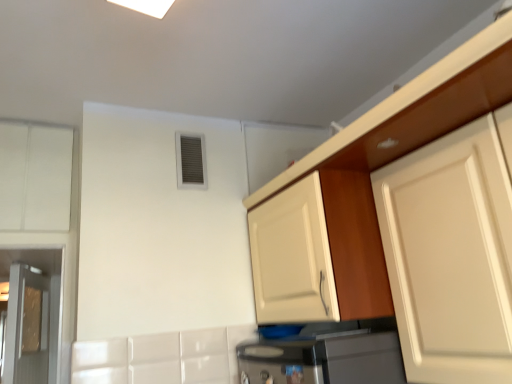
What do you see at coordinates (27, 327) in the screenshot? I see `metallic glass door at left` at bounding box center [27, 327].

What are the coordinates of `metallic glass door at left` in the screenshot? It's located at (27, 327).

From the image's perspective, does matte white cabinet at center, which appears as the second cabinetry when viewed from the left, appear lower than white matte cabinet at left, the 1th cabinetry viewed from the left?

Indeed, from the image's perspective, matte white cabinet at center, which appears as the second cabinetry when viewed from the left, is shown beneath white matte cabinet at left, the 1th cabinetry viewed from the left.

Is matte white cabinet at center, which ranks as the third cabinetry in right-to-left order, turned away from white matte cabinet at left, which appears as the 4th cabinetry when viewed from the right?

No, white matte cabinet at left, which appears as the 4th cabinetry when viewed from the right, is not at the back of matte white cabinet at center, which ranks as the third cabinetry in right-to-left order.

Is matte white cabinet at center, which ranks as the third cabinetry in right-to-left order, smaller than white matte cabinet at left, which appears as the 4th cabinetry when viewed from the right?

Actually, matte white cabinet at center, which ranks as the third cabinetry in right-to-left order, might be larger than white matte cabinet at left, which appears as the 4th cabinetry when viewed from the right.

Which cabinetry is the 1st one when counting from the front of the white matte cabinet at left, the 1th cabinetry viewed from the left? Please provide its 2D coordinates.

[(319, 252)]

The width and height of the screenshot is (512, 384). I want to click on cabinetry that is the 1st object located in front of the white matte cabinet at left, which appears as the 4th cabinetry when viewed from the right, so click(x=319, y=252).

Considering the sizes of white matte cabinet at left, the 1th cabinetry viewed from the left, and matte white cabinet at center, which appears as the second cabinetry when viewed from the left, in the image, is white matte cabinet at left, the 1th cabinetry viewed from the left, wider or thinner than matte white cabinet at center, which appears as the second cabinetry when viewed from the left,?

white matte cabinet at left, the 1th cabinetry viewed from the left, is thinner than matte white cabinet at center, which appears as the second cabinetry when viewed from the left.

From the image's perspective, which is above, white matte cabinet at left, which appears as the 4th cabinetry when viewed from the right, or matte white cabinet at center, which appears as the second cabinetry when viewed from the left?

white matte cabinet at left, which appears as the 4th cabinetry when viewed from the right, appears higher in the image.

Considering the positions of point (56, 188) and point (295, 250), is point (56, 188) closer or farther from the camera than point (295, 250)?

Point (56, 188) is farther from the camera than point (295, 250).

Does white glossy cabinet at upper right, acting as the second cabinetry starting from the right, appear on the left side of metallic glass door at left?

No, white glossy cabinet at upper right, acting as the second cabinetry starting from the right, is not to the left of metallic glass door at left.

Does white glossy cabinet at upper right, acting as the second cabinetry starting from the right, have a smaller size compared to metallic glass door at left?

Correct, white glossy cabinet at upper right, acting as the second cabinetry starting from the right, occupies less space than metallic glass door at left.

From the image's perspective, is white glossy cabinet at upper right, acting as the second cabinetry starting from the right, on metallic glass door at left?

Indeed, from the image's perspective, white glossy cabinet at upper right, acting as the second cabinetry starting from the right, is shown above metallic glass door at left.

Is white glossy cabinet at upper right, placed as the third cabinetry when sorted from left to right, oriented away from metallic glass door at left?

No, metallic glass door at left is not at the back of white glossy cabinet at upper right, placed as the third cabinetry when sorted from left to right.

Between metallic glass door at left and matte white cabinet at center, which appears as the second cabinetry when viewed from the left, which one has more height?

metallic glass door at left is taller.

Can you tell me how much metallic glass door at left and matte white cabinet at center, which appears as the second cabinetry when viewed from the left, differ in facing direction?

The angular difference between metallic glass door at left and matte white cabinet at center, which appears as the second cabinetry when viewed from the left, is 12.4 degrees.

Considering their positions, is metallic glass door at left located in front of or behind matte white cabinet at center, which ranks as the third cabinetry in right-to-left order?

metallic glass door at left is behind matte white cabinet at center, which ranks as the third cabinetry in right-to-left order.

From the image's perspective, is metallic glass door at left beneath matte white cabinet at center, which ranks as the third cabinetry in right-to-left order?

Yes, from the image's perspective, metallic glass door at left is below matte white cabinet at center, which ranks as the third cabinetry in right-to-left order.

From the picture: Does matte white cabinet at center, which ranks as the third cabinetry in right-to-left order, come in front of white matte cabinet at upper right, the first cabinetry viewed from the right?

No.

How different are the orientations of matte white cabinet at center, which appears as the second cabinetry when viewed from the left, and white matte cabinet at upper right, which ranks as the fourth cabinetry in left-to-right order, in degrees?

7.23e-05 degrees.

Who is shorter, matte white cabinet at center, which ranks as the third cabinetry in right-to-left order, or white matte cabinet at upper right, which ranks as the fourth cabinetry in left-to-right order?

matte white cabinet at center, which ranks as the third cabinetry in right-to-left order, is shorter.

Does white glossy cabinet at upper right, placed as the third cabinetry when sorted from left to right, have a smaller size compared to matte white cabinet at center, which appears as the second cabinetry when viewed from the left?

Correct, white glossy cabinet at upper right, placed as the third cabinetry when sorted from left to right, occupies less space than matte white cabinet at center, which appears as the second cabinetry when viewed from the left.

From the image's perspective, would you say white glossy cabinet at upper right, acting as the second cabinetry starting from the right, is shown under matte white cabinet at center, which appears as the second cabinetry when viewed from the left?

No.

Does white glossy cabinet at upper right, placed as the third cabinetry when sorted from left to right, turn towards matte white cabinet at center, which ranks as the third cabinetry in right-to-left order?

No, white glossy cabinet at upper right, placed as the third cabinetry when sorted from left to right, is not turned towards matte white cabinet at center, which ranks as the third cabinetry in right-to-left order.

Is white glossy cabinet at upper right, acting as the second cabinetry starting from the right, far from matte white cabinet at center, which ranks as the third cabinetry in right-to-left order?

white glossy cabinet at upper right, acting as the second cabinetry starting from the right, is near matte white cabinet at center, which ranks as the third cabinetry in right-to-left order, not far away.

Would you say metallic glass door at left is a long distance from white glossy cabinet at upper right, acting as the second cabinetry starting from the right?

Yes, metallic glass door at left and white glossy cabinet at upper right, acting as the second cabinetry starting from the right, are quite far apart.

Which of these two, metallic glass door at left or white glossy cabinet at upper right, placed as the third cabinetry when sorted from left to right, is thinner?

metallic glass door at left is thinner.

Is metallic glass door at left facing towards white glossy cabinet at upper right, placed as the third cabinetry when sorted from left to right?

No, metallic glass door at left is not turned towards white glossy cabinet at upper right, placed as the third cabinetry when sorted from left to right.

From a real-world perspective, is metallic glass door at left physically located above or below white glossy cabinet at upper right, placed as the third cabinetry when sorted from left to right?

From a real-world perspective, metallic glass door at left is physically below white glossy cabinet at upper right, placed as the third cabinetry when sorted from left to right.

Locate an element on the screen. The image size is (512, 384). cabinetry that is the 2nd one below the white matte cabinet at left, the 1th cabinetry viewed from the left (from a real-world perspective) is located at coordinates (319, 252).

From the image's perspective, starting from the white matte cabinet at left, the 1th cabinetry viewed from the left, which cabinetry is the 2nd one below? Please provide its 2D coordinates.

[(319, 252)]

Estimate the real-world distances between objects in this image. Which object is further from white matte cabinet at left, the 1th cabinetry viewed from the left, white matte cabinet at upper right, which ranks as the fourth cabinetry in left-to-right order, or metallic glass door at left?

white matte cabinet at upper right, which ranks as the fourth cabinetry in left-to-right order, is further to white matte cabinet at left, the 1th cabinetry viewed from the left.

Which object lies nearer to the anchor point white matte cabinet at left, the 1th cabinetry viewed from the left, white matte cabinet at upper right, the first cabinetry viewed from the right, or matte white cabinet at center, which appears as the second cabinetry when viewed from the left?

Among the two, matte white cabinet at center, which appears as the second cabinetry when viewed from the left, is located nearer to white matte cabinet at left, the 1th cabinetry viewed from the left.

Looking at the image, which one is located further to metallic glass door at left, white matte cabinet at upper right, the first cabinetry viewed from the right, or matte white cabinet at center, which appears as the second cabinetry when viewed from the left?

Among the two, white matte cabinet at upper right, the first cabinetry viewed from the right, is located further to metallic glass door at left.

Based on their spatial positions, is white glossy cabinet at upper right, placed as the third cabinetry when sorted from left to right, or white matte cabinet at left, which appears as the 4th cabinetry when viewed from the right, closer to metallic glass door at left?

Among the two, white matte cabinet at left, which appears as the 4th cabinetry when viewed from the right, is located nearer to metallic glass door at left.

From the picture: Considering their positions, is matte white cabinet at center, which appears as the second cabinetry when viewed from the left, positioned closer to white glossy cabinet at upper right, placed as the third cabinetry when sorted from left to right, than white matte cabinet at left, which appears as the 4th cabinetry when viewed from the right?

Among the two, matte white cabinet at center, which appears as the second cabinetry when viewed from the left, is located nearer to white glossy cabinet at upper right, placed as the third cabinetry when sorted from left to right.

When comparing their distances from metallic glass door at left, does white matte cabinet at upper right, which ranks as the fourth cabinetry in left-to-right order, or white matte cabinet at left, the 1th cabinetry viewed from the left, seem closer?

white matte cabinet at left, the 1th cabinetry viewed from the left.

Considering their positions, is white glossy cabinet at upper right, acting as the second cabinetry starting from the right, positioned further to white matte cabinet at upper right, the first cabinetry viewed from the right, than white matte cabinet at left, the 1th cabinetry viewed from the left?

white matte cabinet at left, the 1th cabinetry viewed from the left.

Estimate the real-world distances between objects in this image. Which object is further from white matte cabinet at upper right, which ranks as the fourth cabinetry in left-to-right order, white matte cabinet at left, the 1th cabinetry viewed from the left, or matte white cabinet at center, which appears as the second cabinetry when viewed from the left?

The object further to white matte cabinet at upper right, which ranks as the fourth cabinetry in left-to-right order, is white matte cabinet at left, the 1th cabinetry viewed from the left.

You are a GUI agent. You are given a task and a screenshot of the screen. Output one action in this format:
    pyautogui.click(x=<x>, y=<y>)
    Task: Click on the cabinetry positioned between white glossy cabinet at upper right, acting as the second cabinetry starting from the right, and matte white cabinet at center, which ranks as the third cabinetry in right-to-left order, from near to far
    This screenshot has width=512, height=384.
    Given the screenshot: What is the action you would take?
    pyautogui.click(x=452, y=252)

Where is `cabinetry situated between white matte cabinet at left, the 1th cabinetry viewed from the left, and white glossy cabinet at upper right, placed as the third cabinetry when sorted from left to right, from left to right`? This screenshot has width=512, height=384. cabinetry situated between white matte cabinet at left, the 1th cabinetry viewed from the left, and white glossy cabinet at upper right, placed as the third cabinetry when sorted from left to right, from left to right is located at coordinates (319, 252).

The width and height of the screenshot is (512, 384). What are the coordinates of `cabinetry between metallic glass door at left and matte white cabinet at center, which appears as the second cabinetry when viewed from the left, from left to right` in the screenshot? It's located at (35, 177).